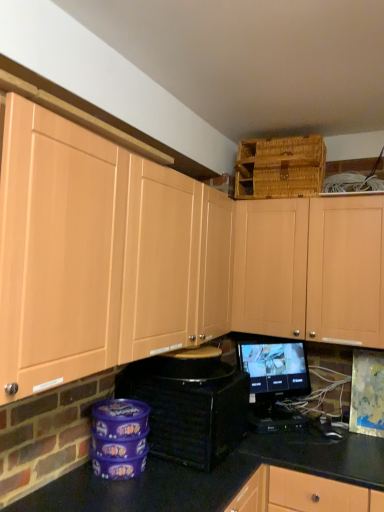
Question: Is woven brown basket at upper right far from black glossy monitor at center?

Choices:
 (A) no
 (B) yes

Answer: (A)

Question: Considering the relative sizes of woven brown basket at upper right and black glossy monitor at center in the image provided, is woven brown basket at upper right taller than black glossy monitor at center?

Choices:
 (A) no
 (B) yes

Answer: (A)

Question: Is woven brown basket at upper right looking in the opposite direction of black glossy monitor at center?

Choices:
 (A) yes
 (B) no

Answer: (B)

Question: Could black glossy monitor at center be considered to be inside woven brown basket at upper right?

Choices:
 (A) no
 (B) yes

Answer: (A)

Question: Can you confirm if woven brown basket at upper right is positioned to the right of black glossy monitor at center?

Choices:
 (A) no
 (B) yes

Answer: (B)

Question: From the image's perspective, is matte wood cabinets at upper left, the first cabinetry positioned from the left, above or below matte wood cabinet at upper center, the second cabinetry from the left?

Choices:
 (A) below
 (B) above

Answer: (B)

Question: Is matte wood cabinets at upper left, arranged as the second cabinetry when viewed from the right, taller or shorter than matte wood cabinet at upper center, the 1th cabinetry from the right?

Choices:
 (A) short
 (B) tall

Answer: (A)

Question: Do you think matte wood cabinets at upper left, the first cabinetry positioned from the left, is within matte wood cabinet at upper center, the second cabinetry from the left, or outside of it?

Choices:
 (A) outside
 (B) inside

Answer: (A)

Question: In the image, is matte wood cabinets at upper left, the first cabinetry positioned from the left, positioned in front of or behind matte wood cabinet at upper center, the second cabinetry from the left?

Choices:
 (A) behind
 (B) front

Answer: (B)

Question: Is black glossy monitor at center bigger or smaller than matte wood cabinets at upper left, the first cabinetry positioned from the left?

Choices:
 (A) big
 (B) small

Answer: (B)

Question: Would you say black glossy monitor at center is inside or outside matte wood cabinets at upper left, arranged as the second cabinetry when viewed from the right?

Choices:
 (A) inside
 (B) outside

Answer: (B)

Question: In the image, is black glossy monitor at center on the left side or the right side of matte wood cabinets at upper left, arranged as the second cabinetry when viewed from the right?

Choices:
 (A) right
 (B) left

Answer: (A)

Question: In terms of height, does black glossy monitor at center look taller or shorter compared to matte wood cabinets at upper left, arranged as the second cabinetry when viewed from the right?

Choices:
 (A) tall
 (B) short

Answer: (B)

Question: Is woven brown basket at upper right taller or shorter than black glossy monitor at center?

Choices:
 (A) tall
 (B) short

Answer: (B)

Question: Visually, is woven brown basket at upper right positioned to the left or to the right of black glossy monitor at center?

Choices:
 (A) right
 (B) left

Answer: (A)